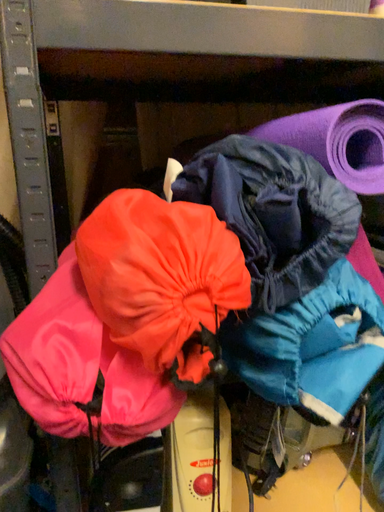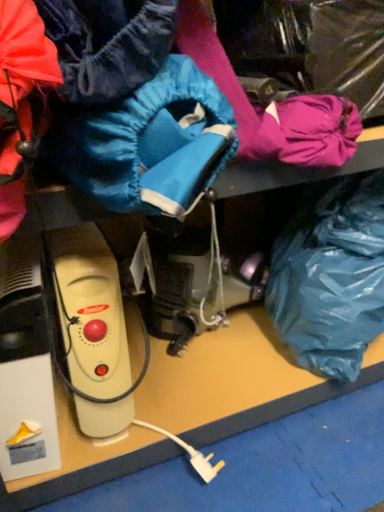
Question: Which way did the camera rotate in the video?

Choices:
 (A) rotated right
 (B) rotated left

Answer: (A)